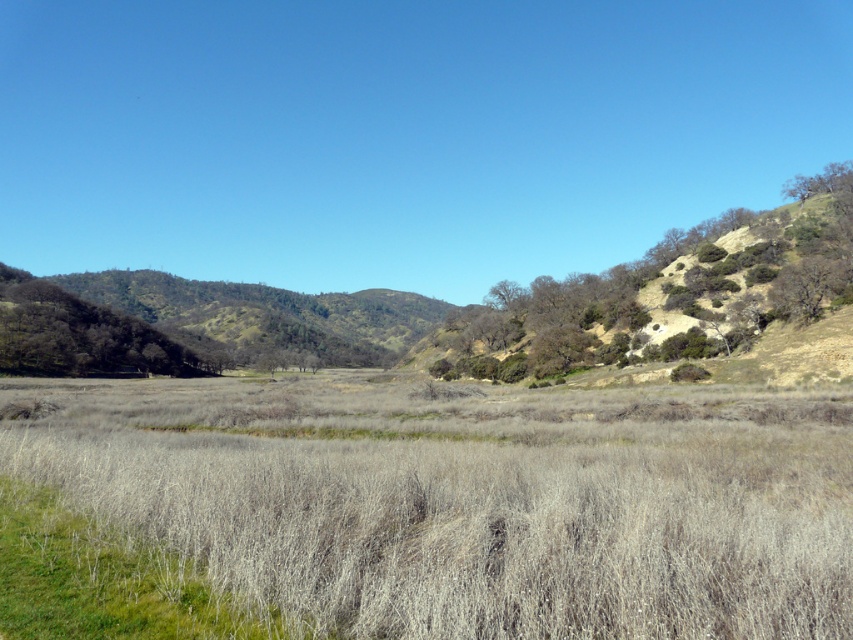
Is point (683, 301) less distant than point (27, 362)?

Yes, it is in front of point (27, 362).

Does green leafy tree at right appear under green leafy tree at left?

No.

Which is in front, point (523, 371) or point (173, 344)?

Point (523, 371) is more forward.

You are a GUI agent. You are given a task and a screenshot of the screen. Output one action in this format:
    pyautogui.click(x=<x>, y=<y>)
    Task: Click on the green leafy tree at right
    The height and width of the screenshot is (640, 853).
    Given the screenshot: What is the action you would take?
    pyautogui.click(x=676, y=288)